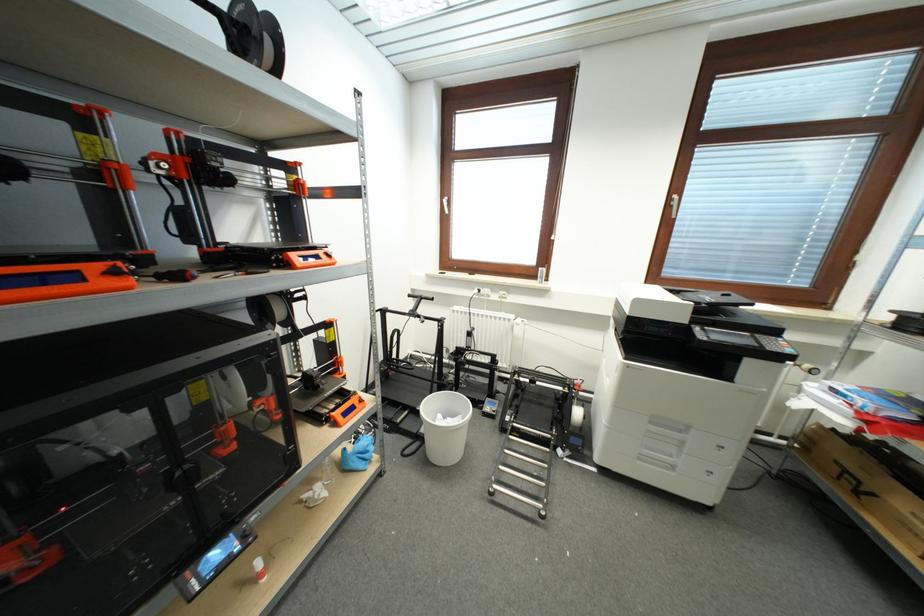
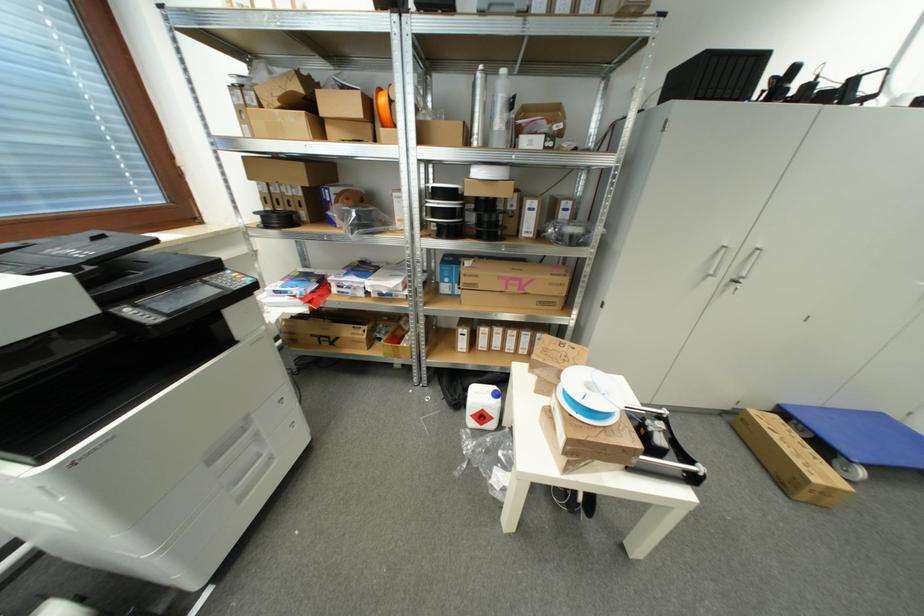
The images are taken continuously from a first-person perspective. In which direction is your viewpoint rotating?

The camera rotated toward right-down.